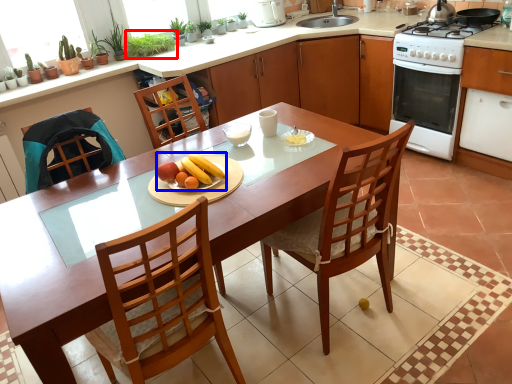
Question: Which point is further to the camera, plant (highlighted by a red box) or fruit dish (highlighted by a blue box)?

Choices:
 (A) plant
 (B) fruit dish

Answer: (A)